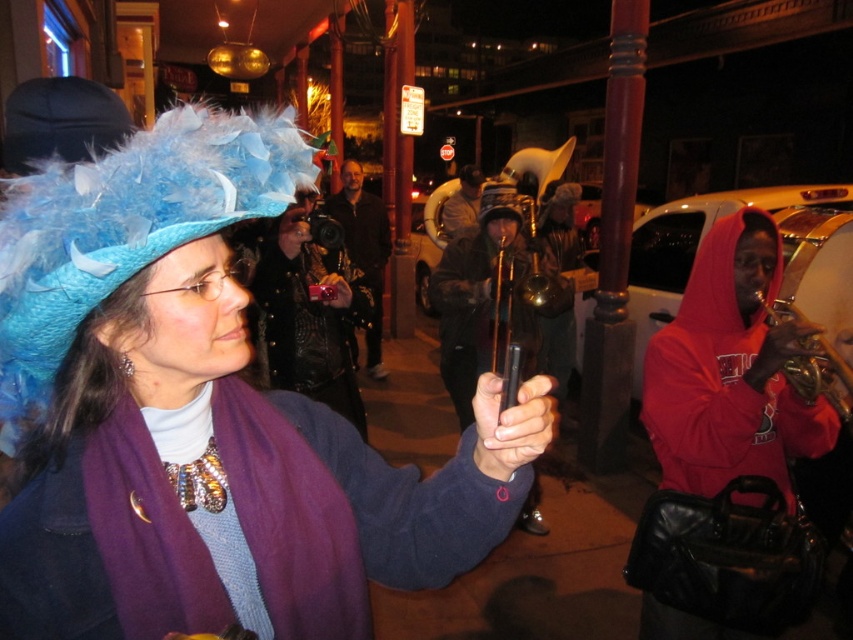
Can you confirm if matte blue feathered hat at center is bigger than blue feathered hat at upper left?

Correct, matte blue feathered hat at center is larger in size than blue feathered hat at upper left.

Does matte blue feathered hat at center have a greater height compared to blue feathered hat at upper left?

Yes.

Identify the location of matte blue feathered hat at center. The width and height of the screenshot is (853, 640). (192, 413).

Locate an element on the screen. matte blue feathered hat at center is located at coordinates (192, 413).

Between shiny black camera at center and metallic silver phone at center, which one appears on the right side from the viewer's perspective?

From the viewer's perspective, metallic silver phone at center appears more on the right side.

Does shiny black camera at center have a smaller size compared to metallic silver phone at center?

Actually, shiny black camera at center might be larger than metallic silver phone at center.

What do you see at coordinates (308, 314) in the screenshot? I see `shiny black camera at center` at bounding box center [308, 314].

Locate an element on the screen. The height and width of the screenshot is (640, 853). shiny black camera at center is located at coordinates (308, 314).

Which of these two, blue feathered hat at upper left or shiny black camera at center, stands shorter?

blue feathered hat at upper left

Is blue feathered hat at upper left positioned behind shiny black camera at center?

That is False.

Image resolution: width=853 pixels, height=640 pixels. I want to click on blue feathered hat at upper left, so click(125, 228).